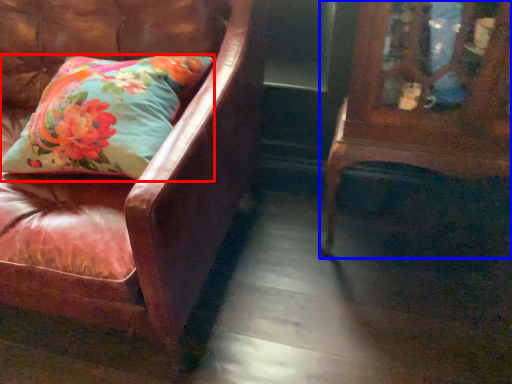
Question: Which point is closer to the camera, pillow (highlighted by a red box) or furniture (highlighted by a blue box)?

Choices:
 (A) pillow
 (B) furniture

Answer: (B)